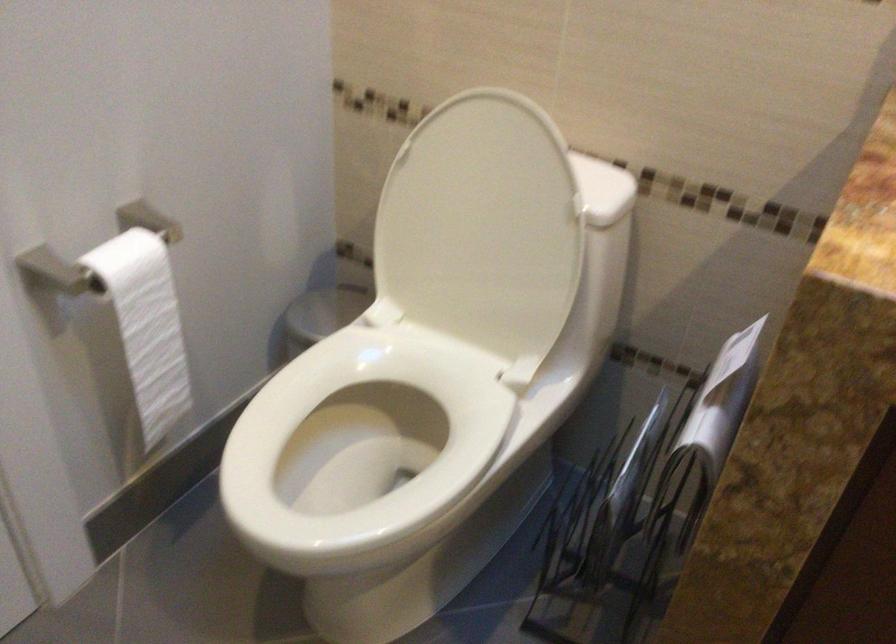
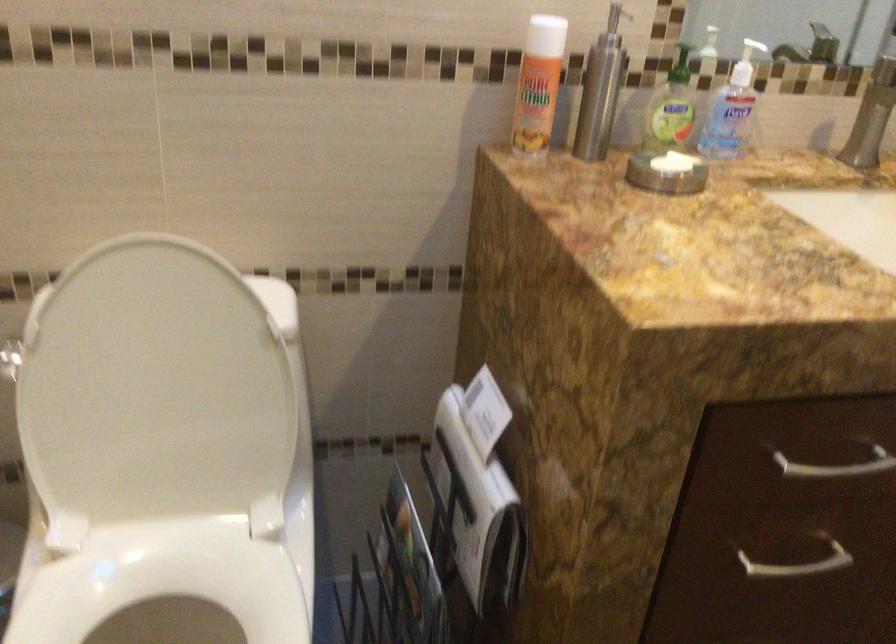
Find the pixel in the second image that matches (429,401) in the first image.

(166, 594)